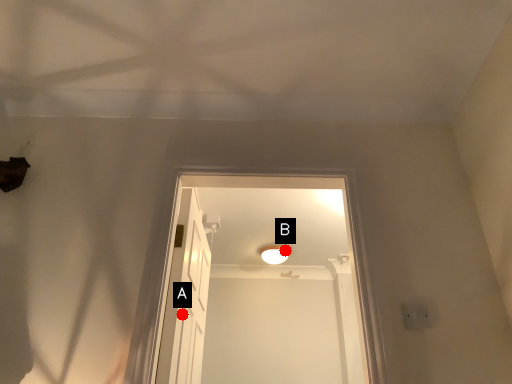
Question: Two points are circled on the image, labeled by A and B beside each circle. Which point is closer to the camera?

Choices:
 (A) A is closer
 (B) B is closer

Answer: (A)